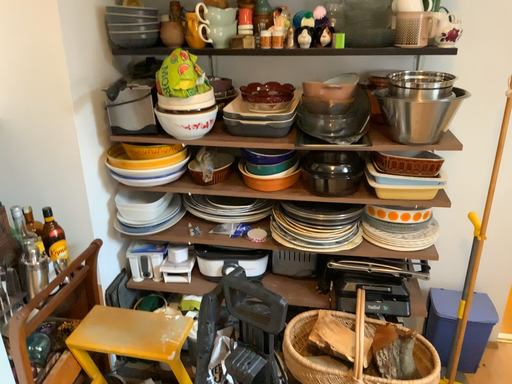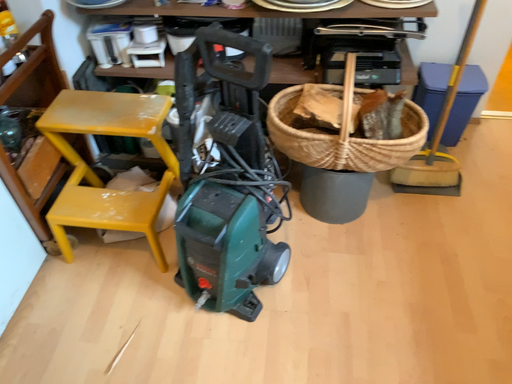
Question: Which way did the camera rotate in the video?

Choices:
 (A) rotated upward
 (B) rotated downward

Answer: (B)